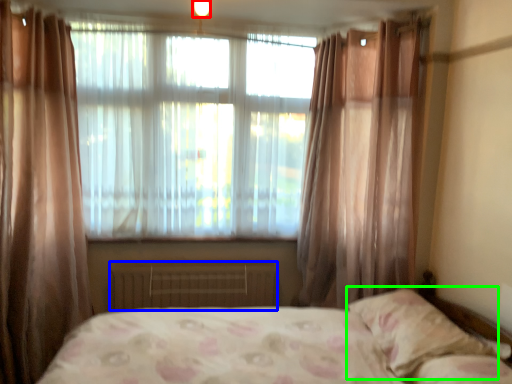
Question: Which object is the closest to the light (highlighted by a red box)? Choose among these: radiator (highlighted by a blue box) or pillow (highlighted by a green box).

Choices:
 (A) radiator
 (B) pillow

Answer: (A)